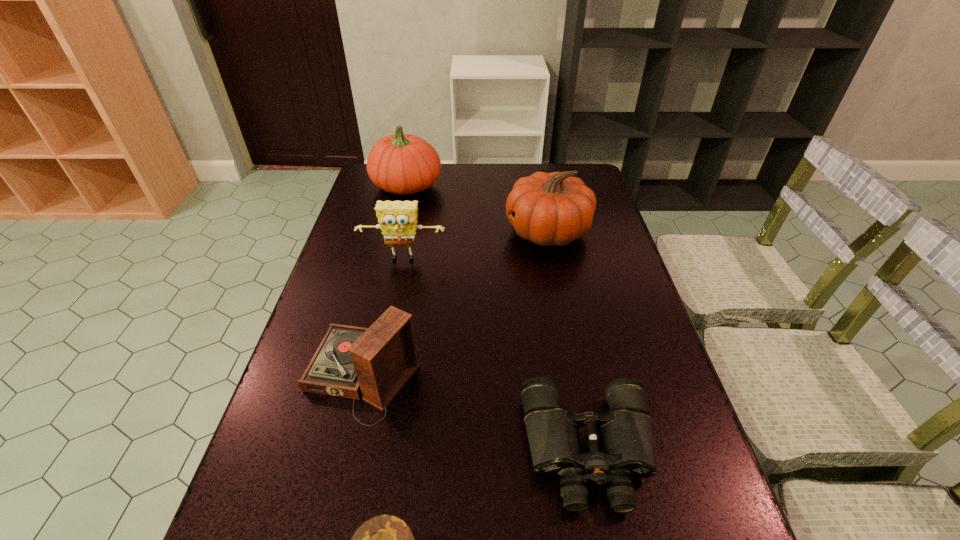
This screenshot has height=540, width=960. What are the coordinates of `vacant region located 0.300m on the face of the sponge` in the screenshot? It's located at (385, 348).

At what (x,y) coordinates should I click in order to perform the action: click on blank space located on the back of the phonograph record. Please return your answer as a coordinate pair (x, y). Looking at the image, I should click on (378, 311).

You are a GUI agent. You are given a task and a screenshot of the screen. Output one action in this format:
    pyautogui.click(x=<x>, y=<y>)
    Task: Click on the object that is at the far edge
    
    Given the screenshot: What is the action you would take?
    pyautogui.click(x=404, y=164)

The height and width of the screenshot is (540, 960). I want to click on pumpkin at the left edge, so click(404, 164).

Where is `sponge that is at the left edge`? sponge that is at the left edge is located at coordinates (397, 219).

Identify the location of phonograph record at the left edge. click(x=376, y=362).

This screenshot has width=960, height=540. I want to click on pumpkin situated at the right edge, so click(549, 209).

Identify the location of binoculars located at the right edge. (625, 436).

Find the location of a particular element. object that is positioned at the far left corner is located at coordinates (404, 164).

The width and height of the screenshot is (960, 540). Identify the location of free space at the left edge of the desktop. (294, 485).